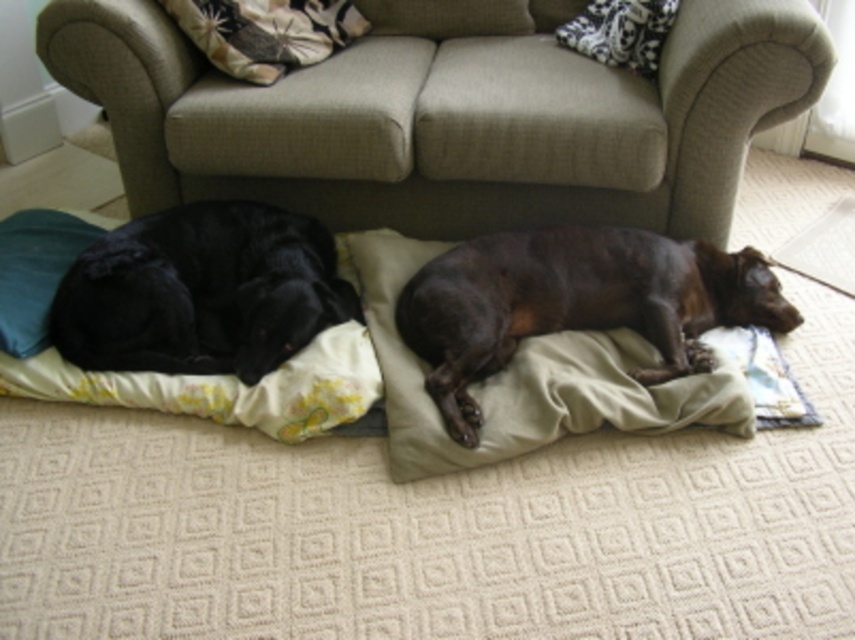
Question: From the image, what is the correct spatial relationship of fluffy fabric pillow at upper center in relation to patterned fabric pillow at upper center?

Choices:
 (A) right
 (B) left

Answer: (B)

Question: Is shiny black dog at left to the right of patterned fabric pillow at upper center from the viewer's perspective?

Choices:
 (A) no
 (B) yes

Answer: (A)

Question: Which object is closer to the camera taking this photo?

Choices:
 (A) fluffy fabric pillow at upper center
 (B) brown fuzzy dog at lower right

Answer: (B)

Question: Which is farther from the patterned fabric pillow at upper center?

Choices:
 (A) shiny black dog at left
 (B) brown fuzzy dog at lower right
 (C) beige fabric couch at upper center
 (D) fluffy fabric pillow at upper center

Answer: (A)

Question: Based on their relative distances, which object is nearer to the brown fuzzy dog at lower right?

Choices:
 (A) shiny black dog at left
 (B) patterned fabric pillow at upper center
 (C) beige fabric couch at upper center
 (D) fluffy fabric pillow at upper center

Answer: (C)

Question: Does beige fabric couch at upper center have a lesser width compared to shiny black dog at left?

Choices:
 (A) no
 (B) yes

Answer: (A)